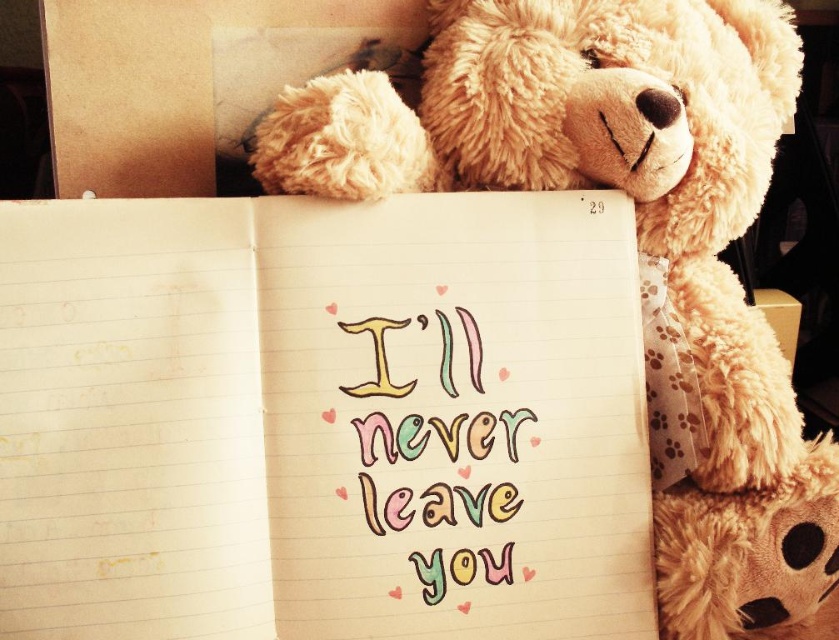
Does fluffy beige teddy bear at upper right have a greater width compared to pastel-colored handwriting at center?

Correct, the width of fluffy beige teddy bear at upper right exceeds that of pastel-colored handwriting at center.

Can you confirm if fluffy beige teddy bear at upper right is thinner than pastel-colored handwriting at center?

In fact, fluffy beige teddy bear at upper right might be wider than pastel-colored handwriting at center.

You are a GUI agent. You are given a task and a screenshot of the screen. Output one action in this format:
    pyautogui.click(x=<x>, y=<y>)
    Task: Click on the fluffy beige teddy bear at upper right
    The height and width of the screenshot is (640, 839).
    Given the screenshot: What is the action you would take?
    pyautogui.click(x=637, y=250)

I want to click on fluffy beige teddy bear at upper right, so click(637, 250).

Is yellow lined paper at upper center taller than fluffy beige teddy bear at upper right?

Incorrect, yellow lined paper at upper center's height is not larger of fluffy beige teddy bear at upper right's.

Describe the element at coordinates (322, 419) in the screenshot. The image size is (839, 640). I see `yellow lined paper at upper center` at that location.

Between point (421, 484) and point (685, 417), which one is positioned in front?

Point (421, 484) is in front.

Find the location of a particular element. yellow lined paper at upper center is located at coordinates (322, 419).

Does yellow lined paper at upper center have a lesser height compared to pastel-colored handwriting at center?

No.

Which is behind, point (266, 621) or point (480, 504)?

The point (480, 504) is behind.

Locate an element on the screen. Image resolution: width=839 pixels, height=640 pixels. yellow lined paper at upper center is located at coordinates (322, 419).

You are a GUI agent. You are given a task and a screenshot of the screen. Output one action in this format:
    pyautogui.click(x=<x>, y=<y>)
    Task: Click on the yellow lined paper at upper center
    This screenshot has height=640, width=839.
    Given the screenshot: What is the action you would take?
    pyautogui.click(x=322, y=419)